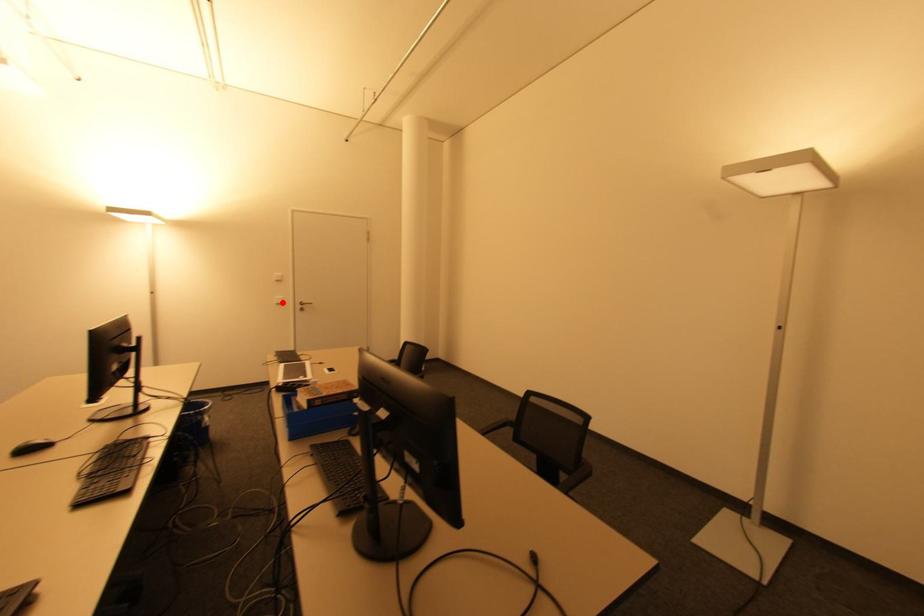
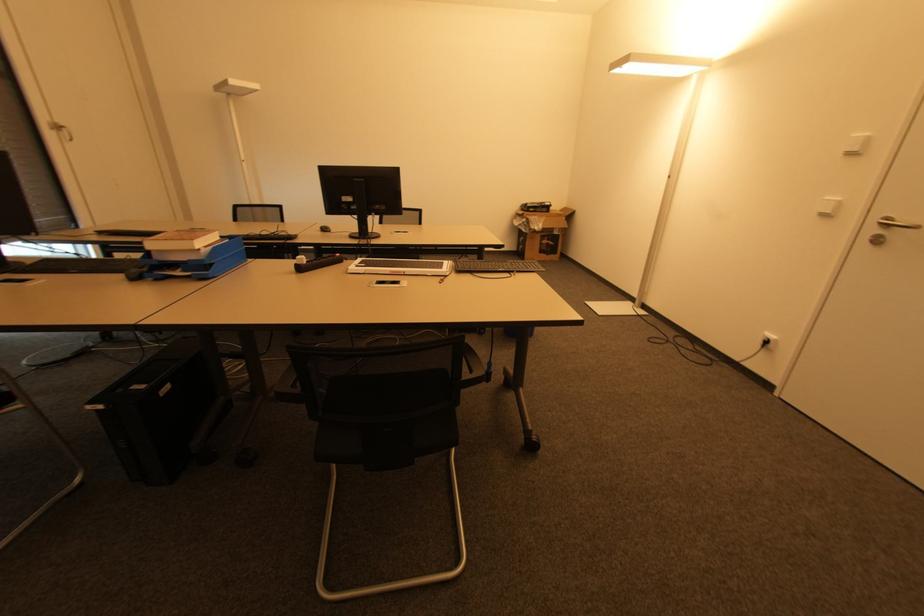
Where in the second image is the point corresponding to the highlighted location from the first image?

(832, 214)